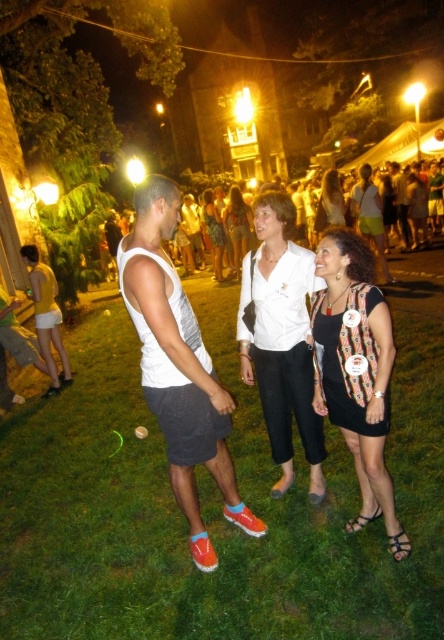
You are a photographer standing at the edge of the gathering. You want to take a photo that includes both the green grass at center and the white matte tank top at center. What is the minimum distance you need to step back to ensure both are fully in frame?

The minimum distance you need to step back is 1.60 meters to include both the green grass at center and the white matte tank top at center in the photo.

You are a photographer at this event and want to capture both the white smooth shirt at center and the white matte shirt at center in a single photo. Your camera has a maximum focus range of 30 feet. Can you fit both subjects within the camera focus range?

The distance between the white smooth shirt at center and the white matte shirt at center is 29.25 feet, which is within the camera focus range of 30 feet. Yes, you can fit both subjects within the camera focus range.

You are a photographer at the event and want to capture a clear shot of the green grass at center and the white matte tank top at center. Which object will appear more detailed in the photo?

The white matte tank top at center will appear more detailed in the photo because it is thicker than the green grass at center.